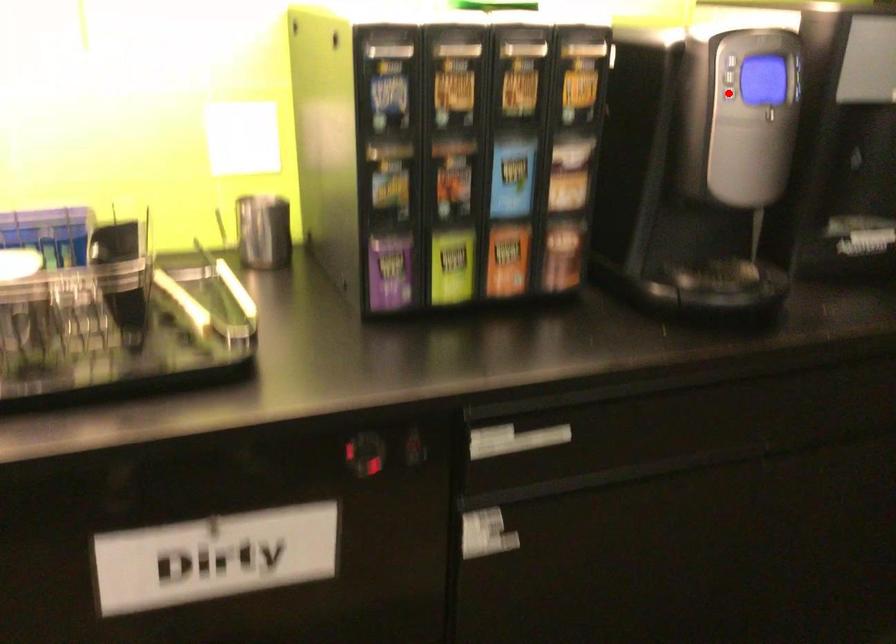
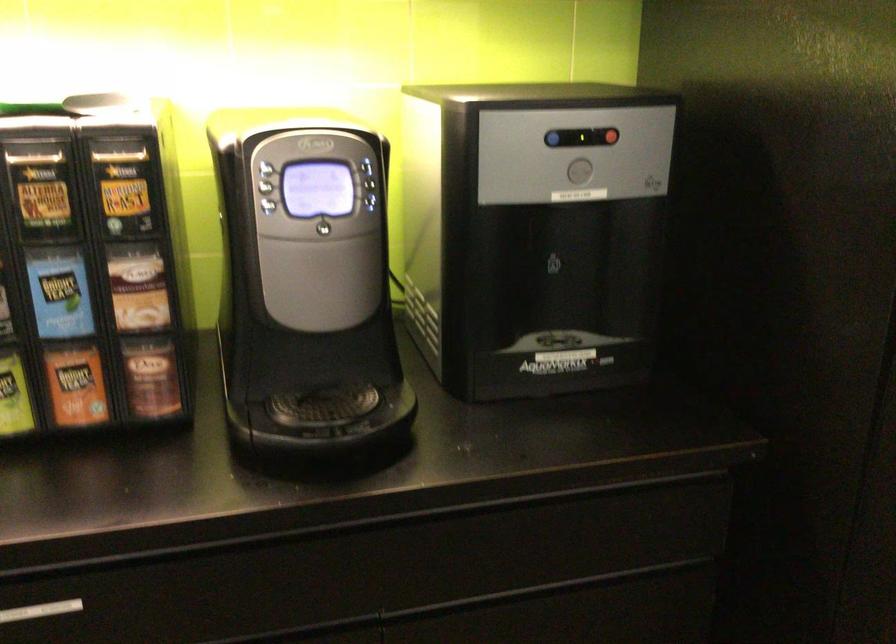
Locate, in the second image, the point that corresponds to the highlighted location in the first image.

(268, 205)